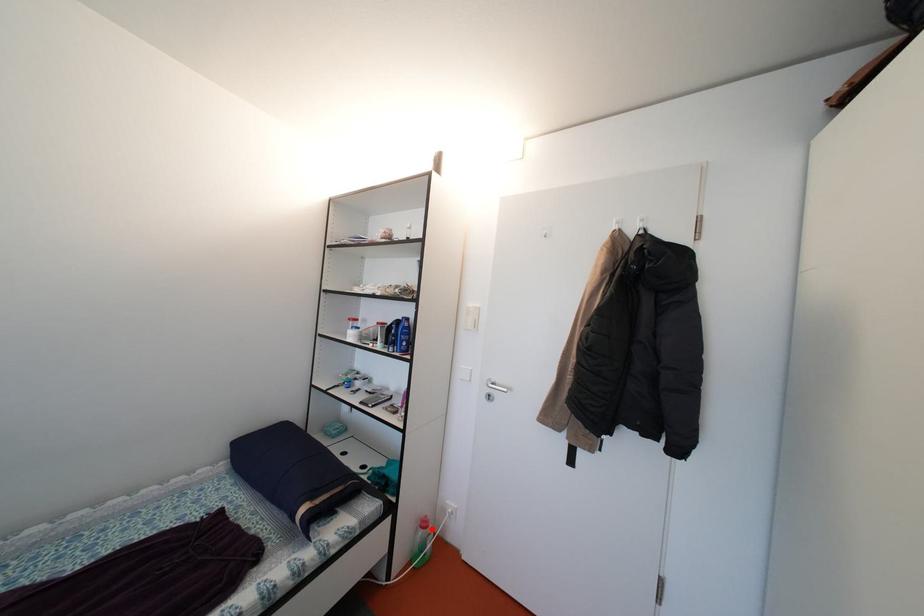
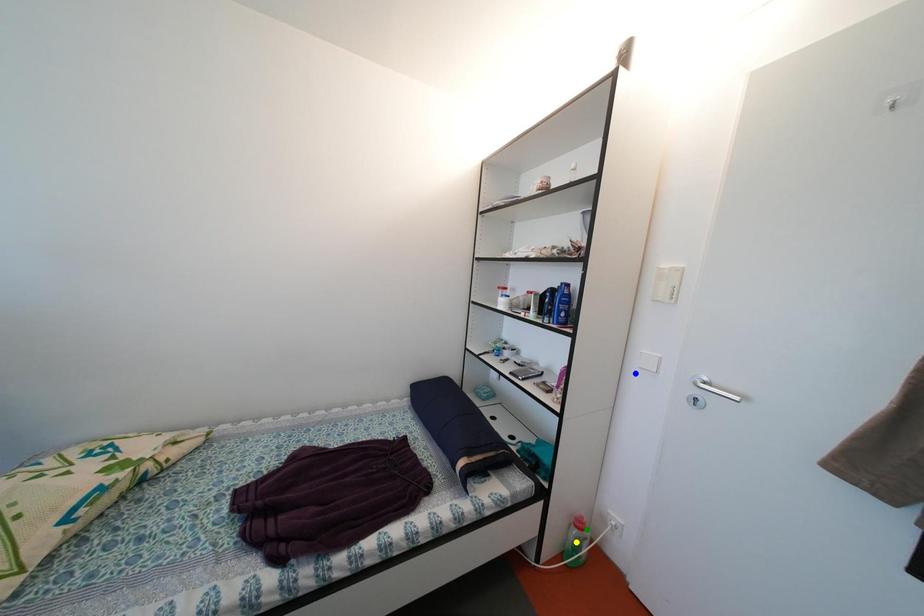
Question: I am providing you with two images of the same scene from different viewpoints. A red point is marked on the first image. You are given multiple points on the second image. Which point in image 2 is actually the same real-world point as the red point in image 1?

Choices:
 (A) green point
 (B) yellow point
 (C) blue point

Answer: (A)